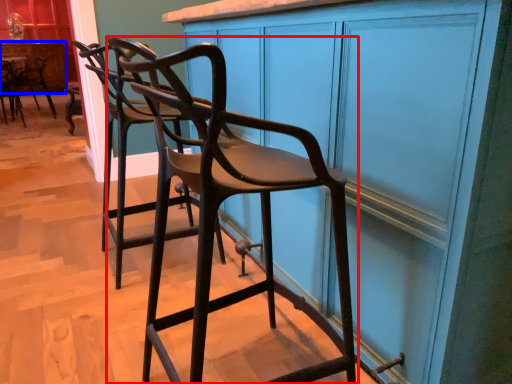
Question: Which of the following is the farthest to the observer, chair (highlighted by a red box) or cabinetry (highlighted by a blue box)?

Choices:
 (A) chair
 (B) cabinetry

Answer: (B)